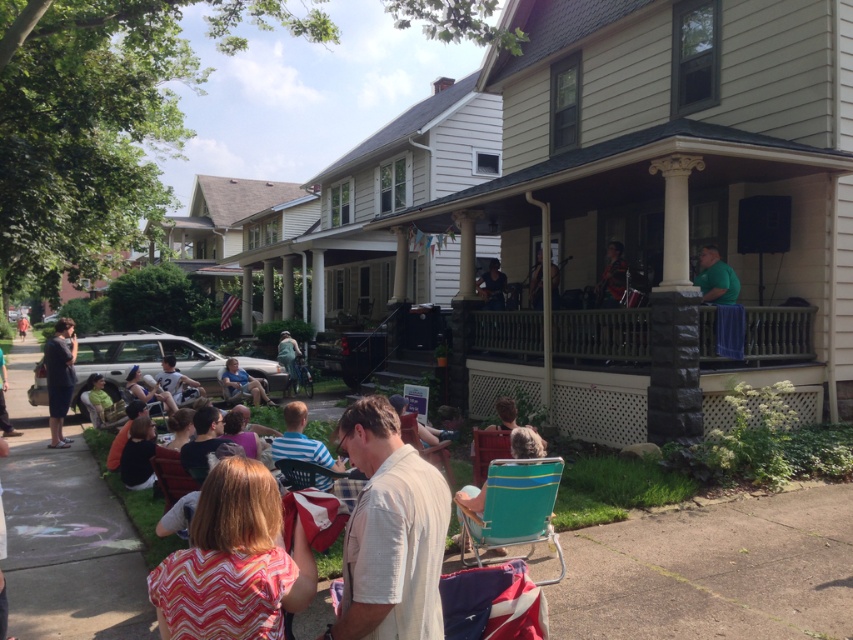
Identify the location of matte blue shirt at lower center. Image resolution: width=853 pixels, height=640 pixels. (242, 384).

Does matte blue shirt at lower center have a greater width compared to dark blue shirt at center?

Yes, matte blue shirt at lower center is wider than dark blue shirt at center.

Is point (242, 372) more distant than point (503, 298)?

Yes, it is.

Image resolution: width=853 pixels, height=640 pixels. Identify the location of matte blue shirt at lower center. (242, 384).

Between point (231, 538) and point (282, 362), which one is positioned in front?

Point (231, 538) is more forward.

Measure the distance between point (279, 522) and camera.

Point (279, 522) is 8.71 feet from camera.

Is point (289, 561) positioned in front of point (289, 353)?

Yes.

The height and width of the screenshot is (640, 853). Find the location of `multicolored zigzag shirt at lower left`. multicolored zigzag shirt at lower left is located at coordinates (233, 563).

Which is below, matte black shirt at center or denim jacket at center?

matte black shirt at center is below.

In the scene shown: Between matte black shirt at center and denim jacket at center, which one has less height?

matte black shirt at center

The height and width of the screenshot is (640, 853). I want to click on matte black shirt at center, so click(x=177, y=381).

Image resolution: width=853 pixels, height=640 pixels. What are the coordinates of `matte black shirt at center` in the screenshot? It's located at (177, 381).